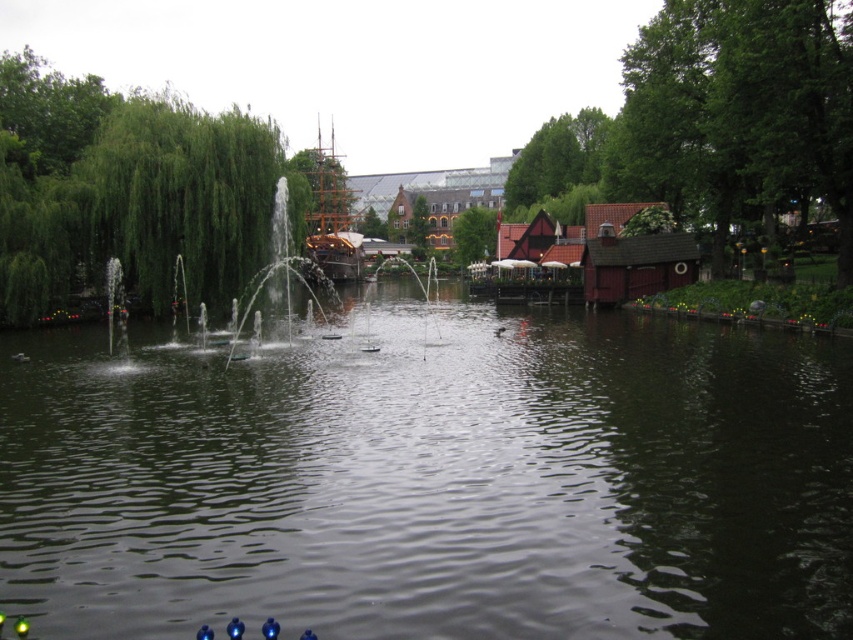
You are standing on the dock and want to take a photo of the dark green water at center and the green leafy tree at center. Which object will appear closer to the camera in the photo?

The dark green water at center will appear closer to the camera in the photo because it is in front of the green leafy tree at center.

You are standing at the edge of the pond and want to know the exact position of the dark green water at center. According to the coordinates provided, where is it located?

The dark green water at center is located at point (433, 481).

You are a landscape architect designing a new garden. You want to place a statue between the green leafy tree at left and the green leafy tree at center. Which tree should the statue be closer to if you want it to be under the taller tree?

The statue should be closer to the green leafy tree at left because it has a greater height compared to the green leafy tree at center.